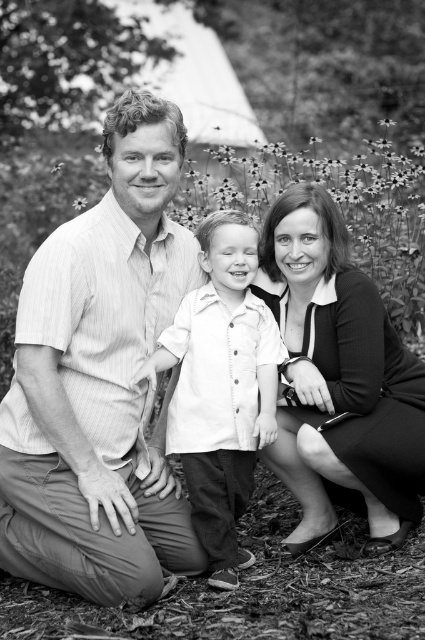
Consider the image. Based on the scene description, where is the striped cotton shirt at left located in the image?

The striped cotton shirt at left is located at point 0.595 on the x axis and 0.235 on the y axis.

You are a photographer trying to capture a group photo. You notice the striped cotton shirt at left and the black smooth dress at center. Which clothing item should you adjust to ensure both are visible in the frame?

The striped cotton shirt at left might be wider than the black smooth dress at center, so you should adjust the striped cotton shirt at left to ensure it fits within the frame.